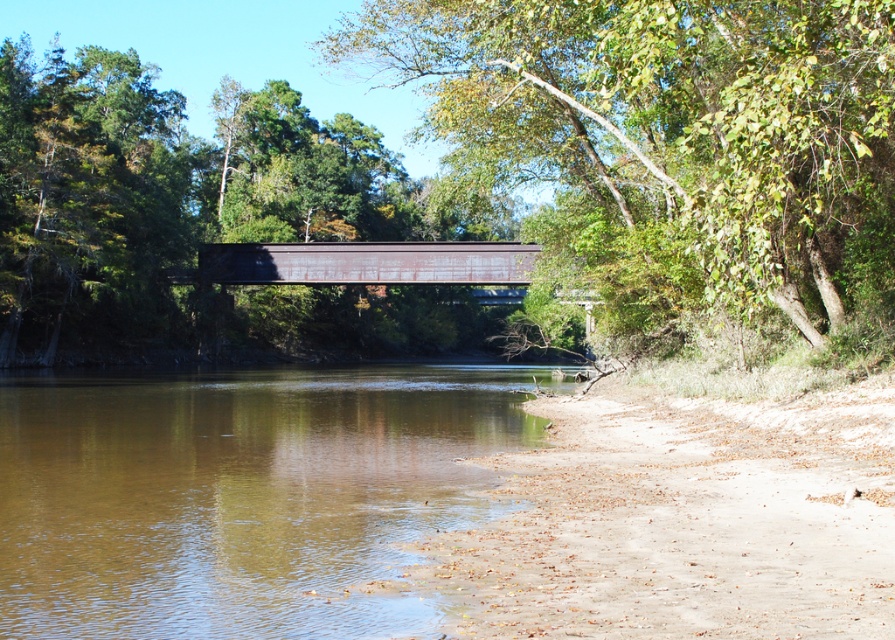
Which of these two, green leafy tree at upper center or rusty metal bridge at center, stands taller?

Standing taller between the two is green leafy tree at upper center.

Does green leafy tree at upper center have a greater height compared to rusty metal bridge at center?

Correct, green leafy tree at upper center is much taller as rusty metal bridge at center.

At what (x,y) coordinates should I click in order to perform the action: click on green leafy tree at upper center. Please return your answer as a coordinate pair (x, y). The height and width of the screenshot is (640, 895). Looking at the image, I should click on [672, 140].

Can you confirm if brown sedimentary water at lower left is shorter than rusty metal bridge at center?

Indeed, brown sedimentary water at lower left has a lesser height compared to rusty metal bridge at center.

Is brown sedimentary water at lower left smaller than rusty metal bridge at center?

Indeed, brown sedimentary water at lower left has a smaller size compared to rusty metal bridge at center.

At what (x,y) coordinates should I click in order to perform the action: click on brown sedimentary water at lower left. Please return your answer as a coordinate pair (x, y). Image resolution: width=895 pixels, height=640 pixels. Looking at the image, I should click on (240, 496).

Locate an element on the screen. brown sedimentary water at lower left is located at coordinates (240, 496).

Which is in front, point (883, 305) or point (422, 605)?

Positioned in front is point (422, 605).

Image resolution: width=895 pixels, height=640 pixels. I want to click on green leafy tree at upper center, so click(x=672, y=140).